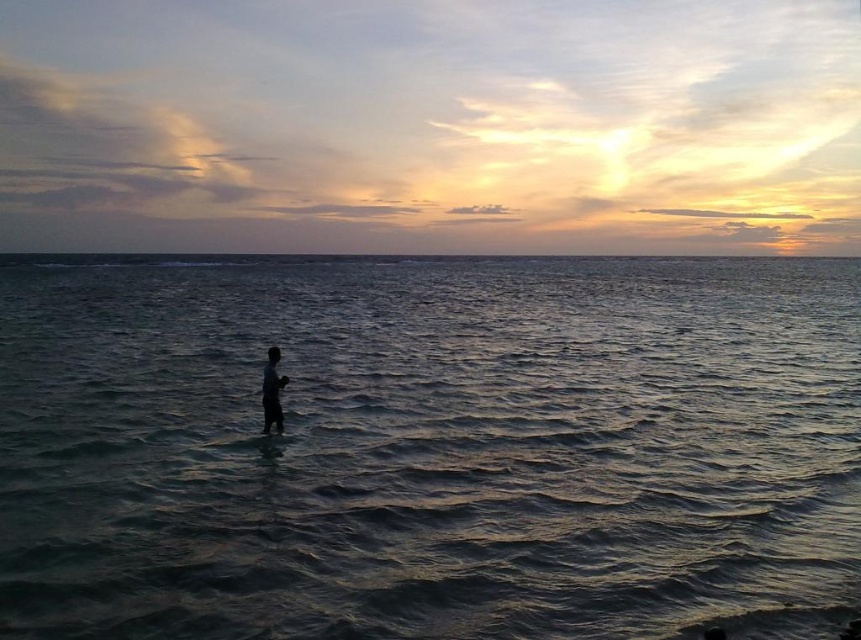
Question: Is dark blue water at center above dark skin human at center?

Choices:
 (A) no
 (B) yes

Answer: (B)

Question: Which object is closer to the camera taking this photo?

Choices:
 (A) dark blue water at center
 (B) dark skin human at center

Answer: (A)

Question: Can you confirm if dark blue water at center is wider than dark skin human at center?

Choices:
 (A) yes
 (B) no

Answer: (A)

Question: Is the position of dark blue water at center more distant than that of dark skin human at center?

Choices:
 (A) yes
 (B) no

Answer: (B)

Question: Which of the following is the closest to the observer?

Choices:
 (A) (274, 348)
 (B) (406, 556)

Answer: (B)